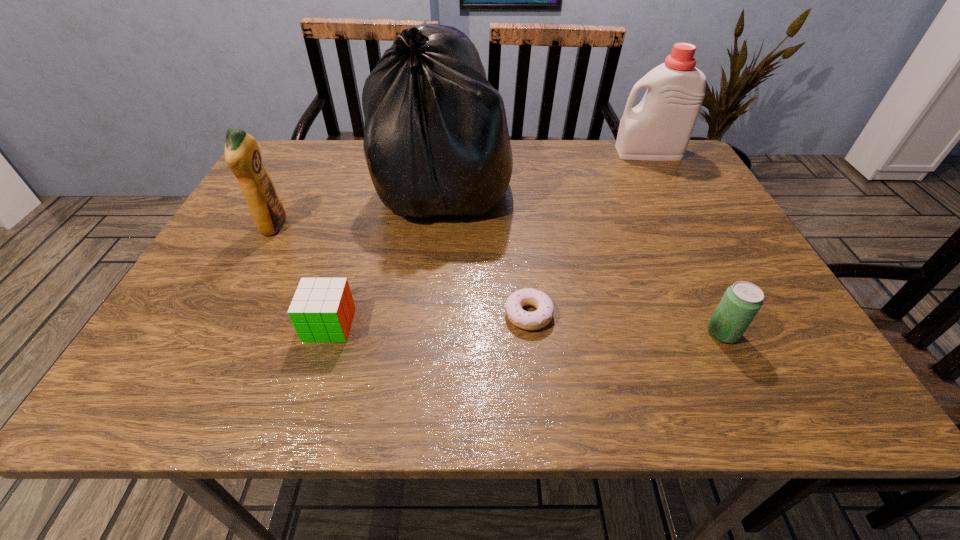
Find the location of a particular element. The image size is (960, 540). object that is at the far right corner is located at coordinates (659, 128).

In the image, there is a desktop. Where is `vacant space at the far edge`? vacant space at the far edge is located at coordinates (347, 166).

Find the location of `vacant region at the near edge of the desktop`. vacant region at the near edge of the desktop is located at coordinates (322, 380).

Where is `vacant region at the left edge of the desktop`? This screenshot has height=540, width=960. vacant region at the left edge of the desktop is located at coordinates (222, 342).

The height and width of the screenshot is (540, 960). Identify the location of vacant space at the right edge. (694, 231).

Locate an element on the screen. free space at the far right corner of the desktop is located at coordinates (684, 173).

Where is `vacant area that lies between the cube and the tallest object`? This screenshot has width=960, height=540. vacant area that lies between the cube and the tallest object is located at coordinates [387, 254].

Image resolution: width=960 pixels, height=540 pixels. I want to click on free spot between the doughnut and the plastic bag, so click(x=487, y=249).

Locate an element on the screen. This screenshot has height=540, width=960. vacant region between the second shortest object and the nearer detergent is located at coordinates (301, 275).

Locate an element on the screen. Image resolution: width=960 pixels, height=540 pixels. empty space that is in between the soda and the doughnut is located at coordinates 626,323.